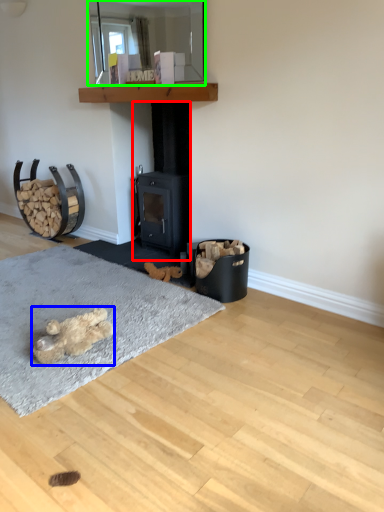
Question: Which is farther away from fireplace (highlighted by a red box)? animal (highlighted by a blue box) or mirror (highlighted by a green box)?

Choices:
 (A) animal
 (B) mirror

Answer: (A)